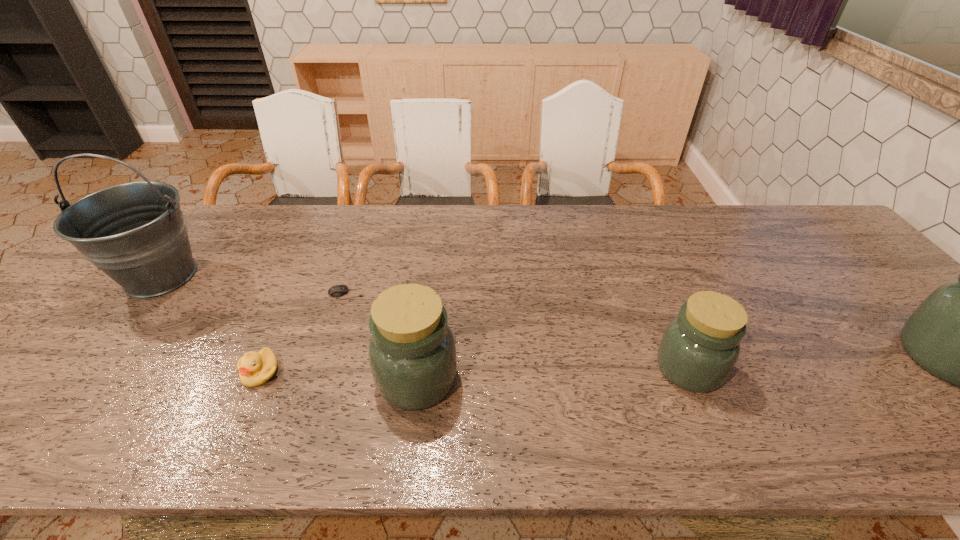
Identify the location of free space located on the left of the fourth shortest object. (285, 379).

You are a GUI agent. You are given a task and a screenshot of the screen. Output one action in this format:
    pyautogui.click(x=<x>, y=<y>)
    Task: Click on the vacant space situated 0.300m on the back of the second object from right to left
    Image resolution: width=960 pixels, height=540 pixels.
    Given the screenshot: What is the action you would take?
    point(643,261)

Identify the location of free spot located 0.370m on the right of the fourth object from right to left. (504, 294).

Where is `vacant space located 0.150m on the front of the tallest object`? vacant space located 0.150m on the front of the tallest object is located at coordinates (96, 357).

I want to click on object that is positioned at the far edge, so click(135, 232).

Locate an element on the screen. duckling at the near edge is located at coordinates (255, 368).

At what (x,y) coordinates should I click in order to perform the action: click on object that is at the left edge. Please return your answer as a coordinate pair (x, y). Looking at the image, I should click on (135, 232).

Locate an element on the screen. object that is at the far left corner is located at coordinates (135, 232).

The width and height of the screenshot is (960, 540). In the image, there is a desktop. Identify the location of free space at the far edge. (483, 240).

At what (x,y) coordinates should I click in order to perform the action: click on vacant space at the near edge. Please return your answer as a coordinate pair (x, y). Looking at the image, I should click on (470, 380).